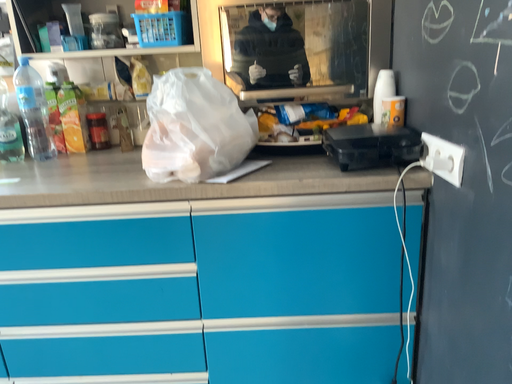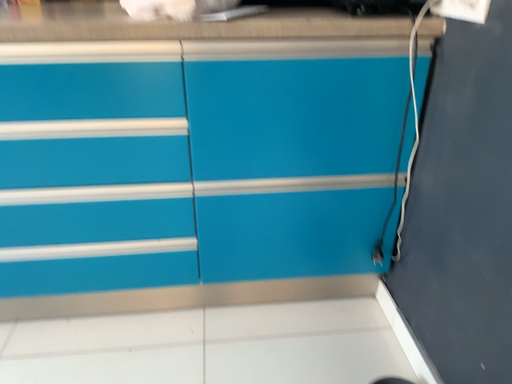
Question: How did the camera likely rotate when shooting the video?

Choices:
 (A) rotated downward
 (B) rotated upward

Answer: (A)